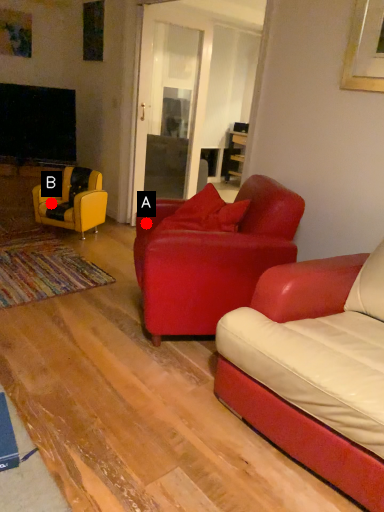
Question: Two points are circled on the image, labeled by A and B beside each circle. Which point is farther from the camera taking this photo?

Choices:
 (A) A is further
 (B) B is further

Answer: (B)